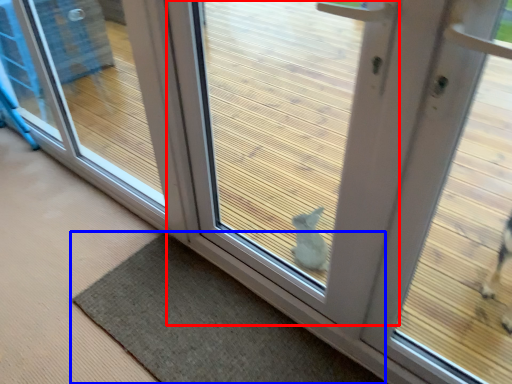
Question: Which object is closer to the camera taking this photo, door (highlighted by a red box) or mat (highlighted by a blue box)?

Choices:
 (A) door
 (B) mat

Answer: (A)